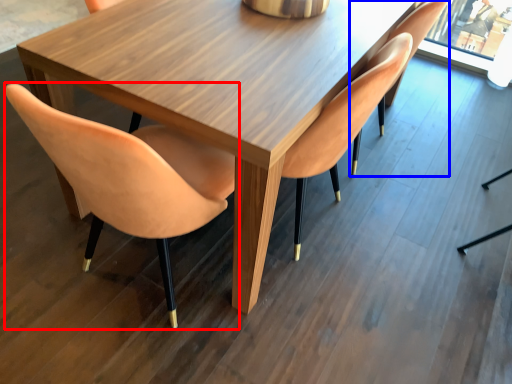
Question: Among these objects, which one is nearest to the camera, chair (highlighted by a red box) or chair (highlighted by a blue box)?

Choices:
 (A) chair
 (B) chair

Answer: (A)